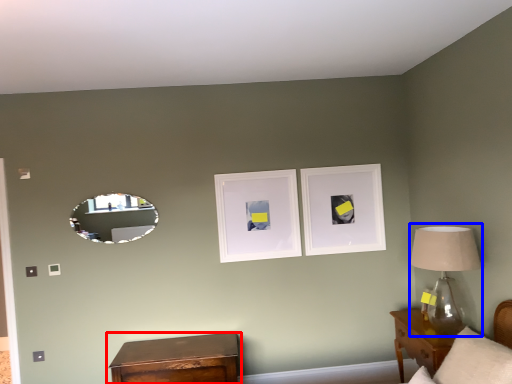
Question: Among these objects, which one is farthest to the camera, nightstand (highlighted by a red box) or table lamp (highlighted by a blue box)?

Choices:
 (A) nightstand
 (B) table lamp

Answer: (A)